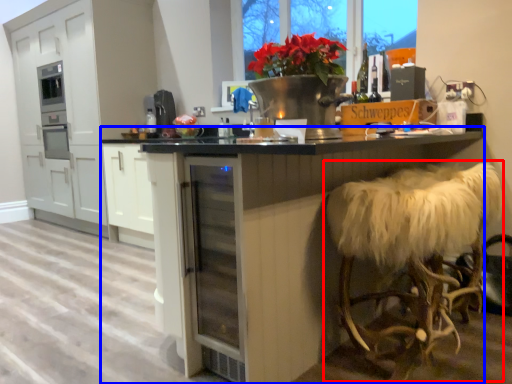
Question: Among these objects, which one is nearest to the camera, swivel chair (highlighted by a red box) or table (highlighted by a blue box)?

Choices:
 (A) swivel chair
 (B) table

Answer: (B)